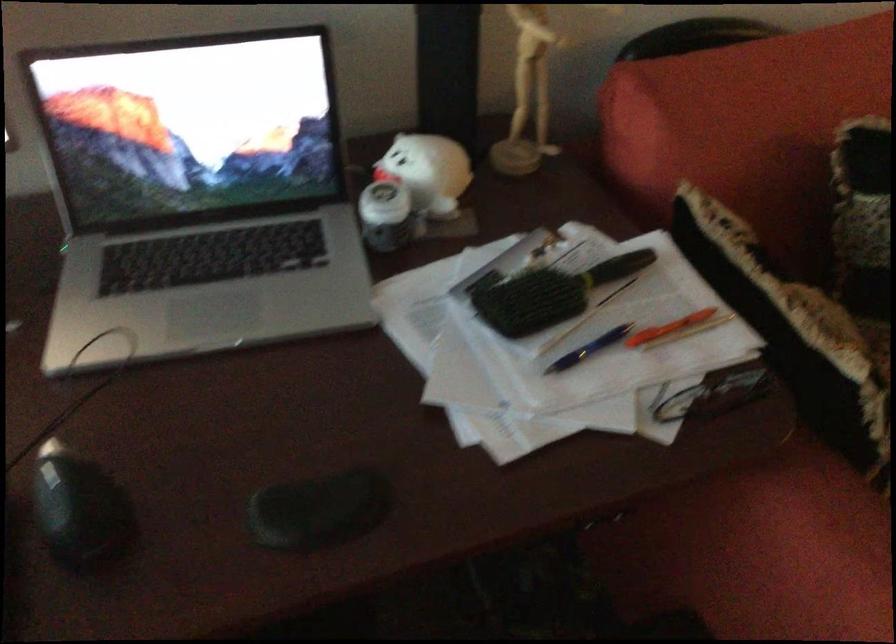
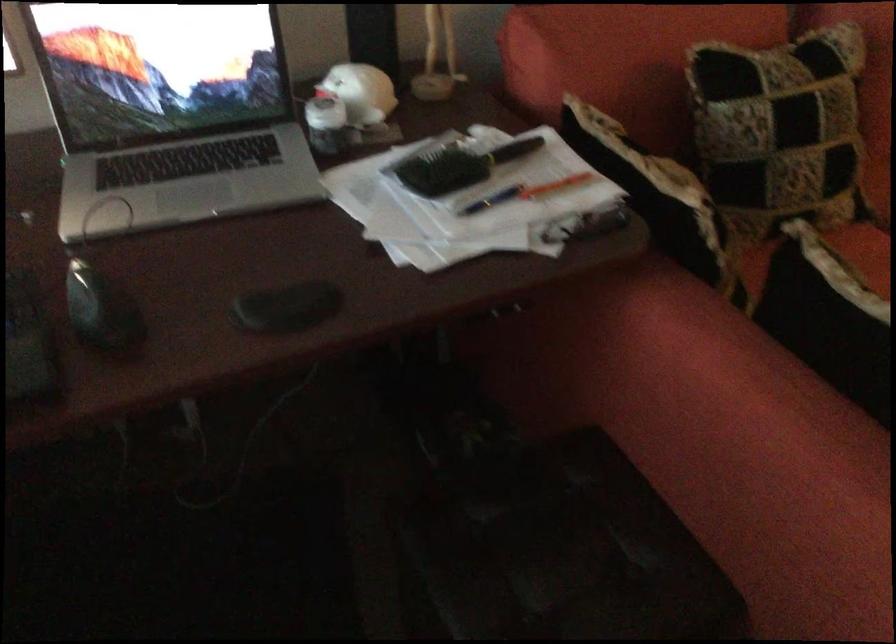
Question: Which direction would the cameraman need to move to produce the second image? Reply with the corresponding letter.

Choices:
 (A) Left
 (B) Right
 (C) Forward
 (D) Backward

Answer: (D)